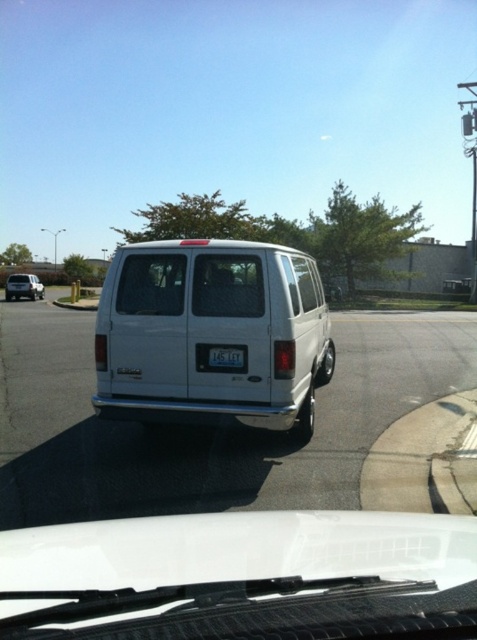
Question: Does transparent glass windshield at rear appear on the left side of white matte van at left?

Choices:
 (A) no
 (B) yes

Answer: (A)

Question: Does white matte van at center appear over white matte van at left?

Choices:
 (A) no
 (B) yes

Answer: (A)

Question: Based on their relative distances, which object is farther from the clear glass windshield at center?

Choices:
 (A) transparent glass windshield at rear
 (B) white plastic license plate at center
 (C) white matte van at center
 (D) white matte van at left

Answer: (D)

Question: Is clear glass windshield at center positioned behind white matte van at left?

Choices:
 (A) no
 (B) yes

Answer: (A)

Question: Estimate the real-world distances between objects in this image. Which object is farther from the white matte van at left?

Choices:
 (A) white plastic license plate at center
 (B) transparent glass windshield at rear
 (C) white matte van at center
 (D) clear glass windshield at center

Answer: (A)

Question: Among these points, which one is nearest to the camera?

Choices:
 (A) (209, 352)
 (B) (165, 310)
 (C) (290, 250)
 (D) (27, 284)

Answer: (A)